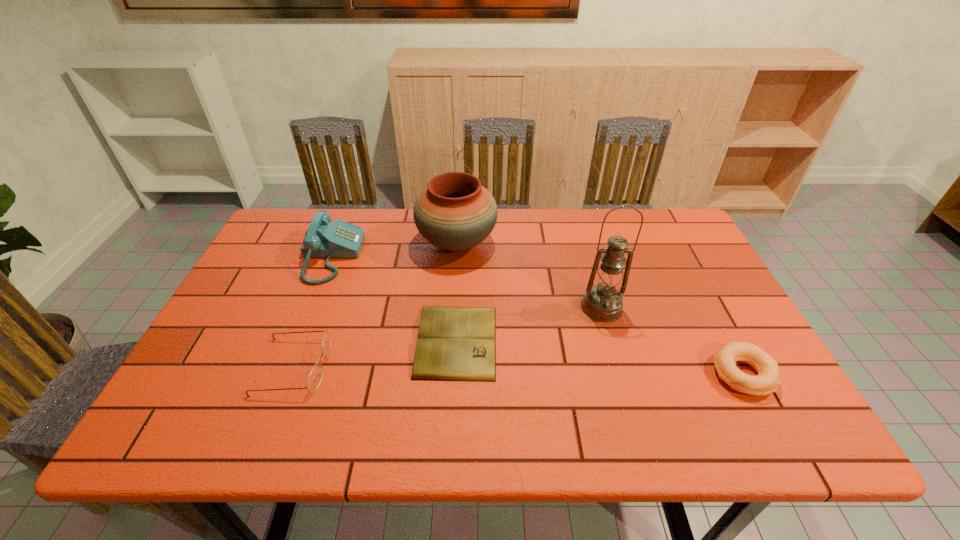
Where is `vacant region that satisfies the following two spatial constraints: 1. on the front side of the shortest object; 2. on the left side of the rightmost object`? Image resolution: width=960 pixels, height=540 pixels. vacant region that satisfies the following two spatial constraints: 1. on the front side of the shortest object; 2. on the left side of the rightmost object is located at coordinates (455, 374).

At what (x,y) coordinates should I click in order to perform the action: click on vacant area that satisfies the following two spatial constraints: 1. on the front side of the fifth object from left to right; 2. on the right side of the bagel. Please return your answer as a coordinate pair (x, y). The width and height of the screenshot is (960, 540). Looking at the image, I should click on (621, 374).